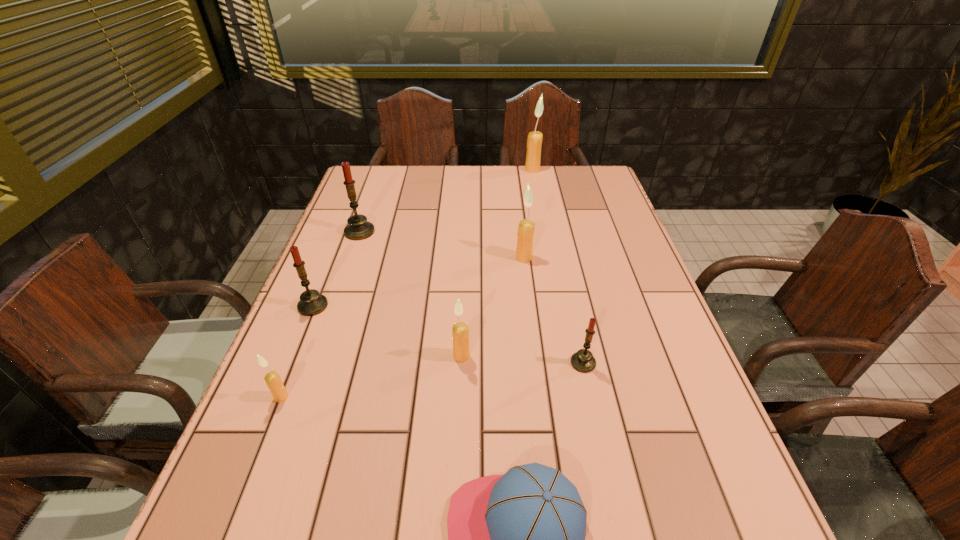
I want to click on blank space located 0.270m on the back of the nearest candle, so click(x=321, y=298).

In order to click on object that is at the far edge in this screenshot , I will do `click(533, 157)`.

Locate an element on the screen. vacant space at the far edge of the desktop is located at coordinates (460, 198).

Find the location of `free region at the left edge of the desktop`. free region at the left edge of the desktop is located at coordinates (379, 231).

Identify the location of free spot at the right edge of the desktop. (637, 362).

The height and width of the screenshot is (540, 960). I want to click on vacant region at the far left corner of the desktop, so click(x=366, y=170).

Where is `free space at the far right corner of the desktop`? The image size is (960, 540). free space at the far right corner of the desktop is located at coordinates (558, 166).

I want to click on free space between the rightmost cream candle and the second nearest object, so click(x=407, y=284).

This screenshot has height=540, width=960. In order to click on empty space that is in between the smallest cream candle and the second nearest cream candle in this screenshot , I will do `click(372, 376)`.

In order to click on vacant point located between the fourth farthest object and the smallest cream candle in this screenshot , I will do `click(298, 352)`.